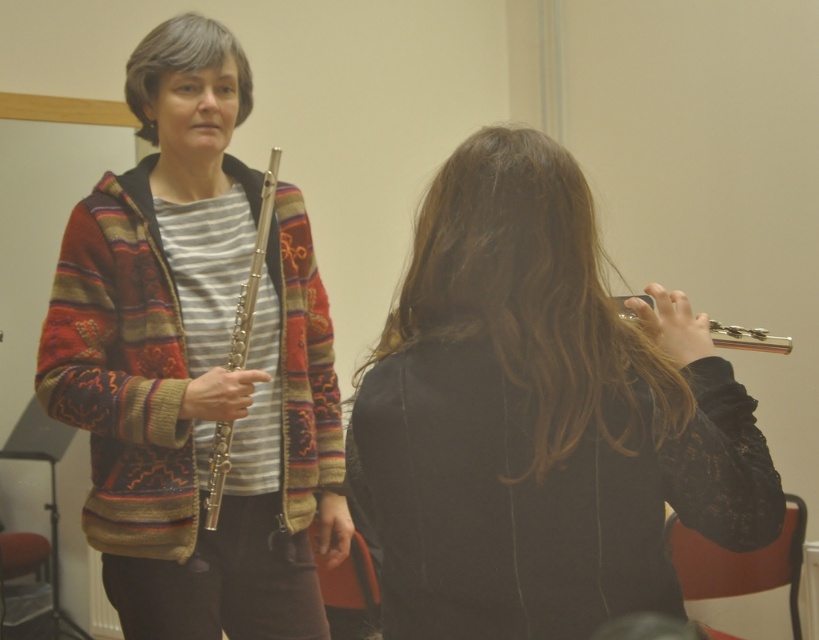
Question: Is black fabric jacket at center smaller than silver metallic flute at left?

Choices:
 (A) no
 (B) yes

Answer: (A)

Question: Which point is closer to the camera?

Choices:
 (A) (274, 156)
 (B) (747, 342)
 (C) (279, 300)
 (D) (572, 221)

Answer: (D)

Question: Is black fabric jacket at center to the left of knitted wool sweater at center from the viewer's perspective?

Choices:
 (A) no
 (B) yes

Answer: (A)

Question: Which of the following is the closest to the observer?

Choices:
 (A) (102, 448)
 (B) (206, 520)

Answer: (B)

Question: Does knitted wool sweater at center lie in front of silver metallic flute at right?

Choices:
 (A) yes
 (B) no

Answer: (B)

Question: Which of the following is the closest to the observer?

Choices:
 (A) (231, 349)
 (B) (630, 314)
 (C) (216, 296)

Answer: (B)